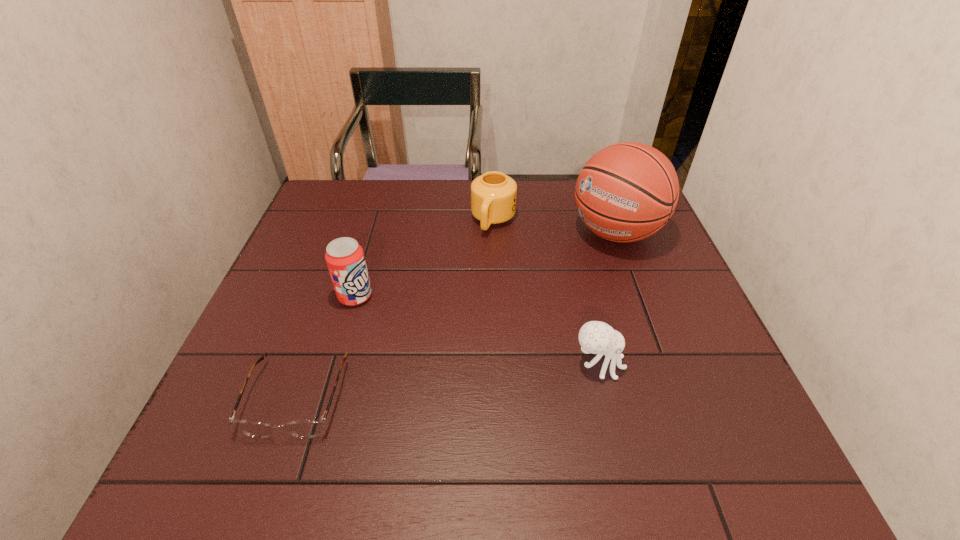
Find the location of a particular element. The width and height of the screenshot is (960, 540). free space that satisfies the following two spatial constraints: 1. on the front side of the third farthest object; 2. on the front-facing side of the octopus is located at coordinates (336, 364).

Where is `vacant position in the image that satisfies the following two spatial constraints: 1. on the front side of the fourth shortest object; 2. on the front-facing side of the octopus`? The width and height of the screenshot is (960, 540). vacant position in the image that satisfies the following two spatial constraints: 1. on the front side of the fourth shortest object; 2. on the front-facing side of the octopus is located at coordinates click(x=336, y=364).